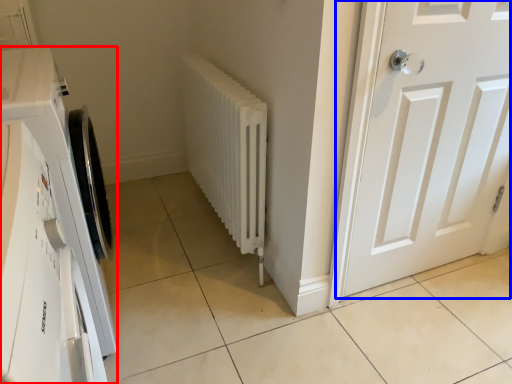
Question: Which object appears closest to the camera in this image, washing machine (highlighted by a red box) or door (highlighted by a blue box)?

Choices:
 (A) washing machine
 (B) door

Answer: (A)